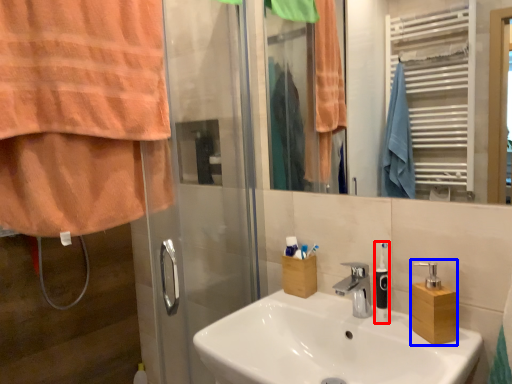
Question: Which object is further to the camera taking this photo, soap dispenser (highlighted by a red box) or soap dispenser (highlighted by a blue box)?

Choices:
 (A) soap dispenser
 (B) soap dispenser

Answer: (A)